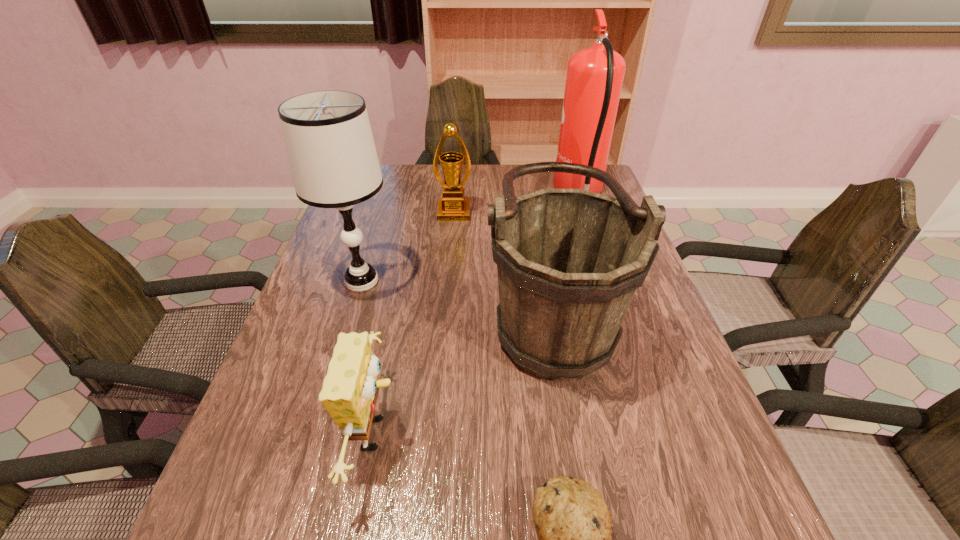
Identify which object is the fifth nearest to the fourth tallest object. Please provide its 2D coordinates. Your answer should be formatted as a tuple, i.e. [(x, y)], where the tuple contains the x and y coordinates of a point satisfying the conditions above.

[(572, 522)]

Locate which object ranks third in proximity to the bucket. Please provide its 2D coordinates. Your answer should be formatted as a tuple, i.e. [(x, y)], where the tuple contains the x and y coordinates of a point satisfying the conditions above.

[(572, 522)]

Locate an element on the screen. free location that satisfies the following two spatial constraints: 1. towards the nozzle of the fire extinguisher; 2. on the front-facing side of the fourth object from right to left is located at coordinates (587, 213).